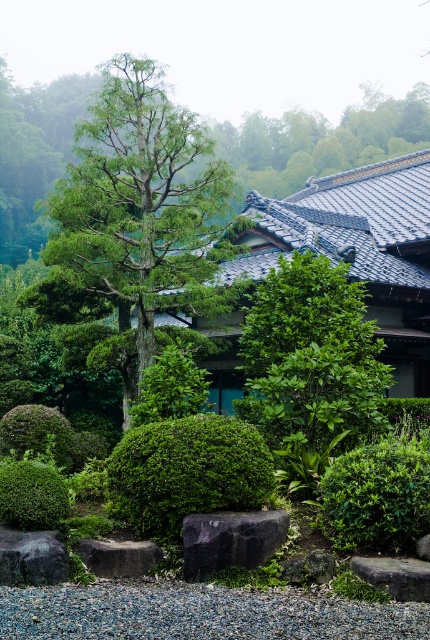
You are standing at the entrance of the garden and want to locate the green textured tree at center. According to the garden layout, where should you look relative to the entrance?

The green textured tree at center is located at the central area of the garden, so you should look towards the middle of the garden from the entrance.

You are a visitor walking along the gravel pathway in the Japanese garden and want to take a closer look at the green textured tree at center and the green leafy bush at lower right. Which object will you reach first as you approach them?

You will reach the green textured tree at center first because it is closer to you than the green leafy bush at lower right, which is further away.

You are a gardener planning to water the green textured tree at center and the green leafy bush at lower right. Based on their positions, which one should you water first if you start from the left side of the garden?

The green textured tree at center should be watered first because it is positioned to the left of the green leafy bush at lower right.